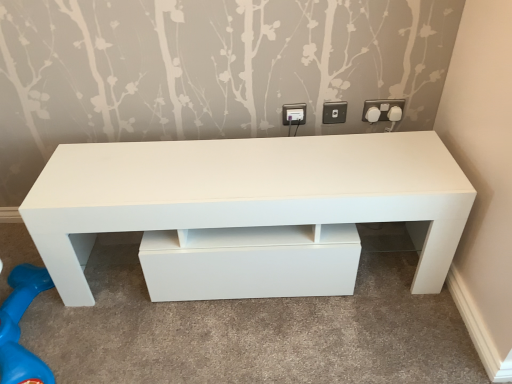
Identify the location of free space in front of white glossy table at center. The height and width of the screenshot is (384, 512). (259, 339).